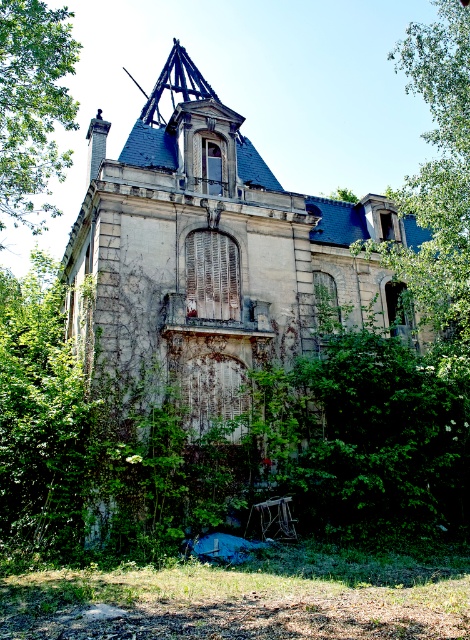
Does weathered stone mansion at center have a lesser height compared to green leafy tree at upper right?

Correct, weathered stone mansion at center is not as tall as green leafy tree at upper right.

How distant is weathered stone mansion at center from green leafy tree at upper right?

The distance of weathered stone mansion at center from green leafy tree at upper right is 16.96 meters.

Measure the distance between weathered stone mansion at center and camera.

The distance of weathered stone mansion at center from camera is 45.92 meters.

Locate an element on the screen. The image size is (470, 640). weathered stone mansion at center is located at coordinates (214, 253).

Is green leafy tree at upper right bigger than green leafy tree at upper left?

Yes.

Which of these two, green leafy tree at upper right or green leafy tree at upper left, stands shorter?

Standing shorter between the two is green leafy tree at upper left.

Find the location of a particular element. This screenshot has height=640, width=470. green leafy tree at upper right is located at coordinates (438, 186).

Is point (359, 264) behind point (20, 81)?

That is True.

Is weathered stone mansion at center smaller than green leafy tree at upper left?

No.

This screenshot has width=470, height=640. What do you see at coordinates (214, 253) in the screenshot? I see `weathered stone mansion at center` at bounding box center [214, 253].

The height and width of the screenshot is (640, 470). Identify the location of weathered stone mansion at center. point(214,253).